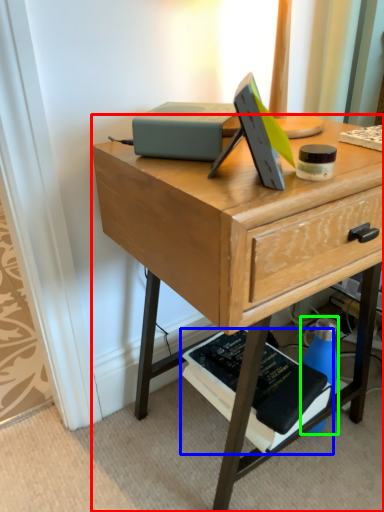
Question: Which object is the farthest from desk (highlighted by a red box)? Choose among these: paperback book (highlighted by a blue box) or bottle (highlighted by a green box).

Choices:
 (A) paperback book
 (B) bottle

Answer: (B)